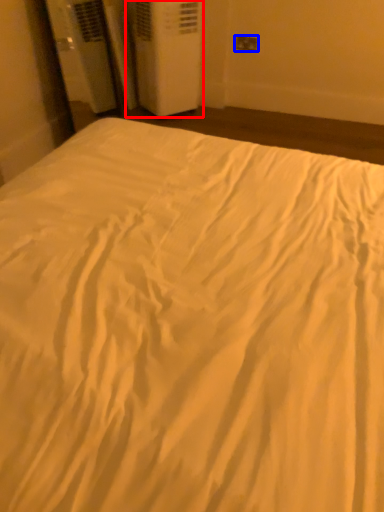
Question: Which point is further to the camera, air conditioning (highlighted by a red box) or electric outlet (highlighted by a blue box)?

Choices:
 (A) air conditioning
 (B) electric outlet

Answer: (B)